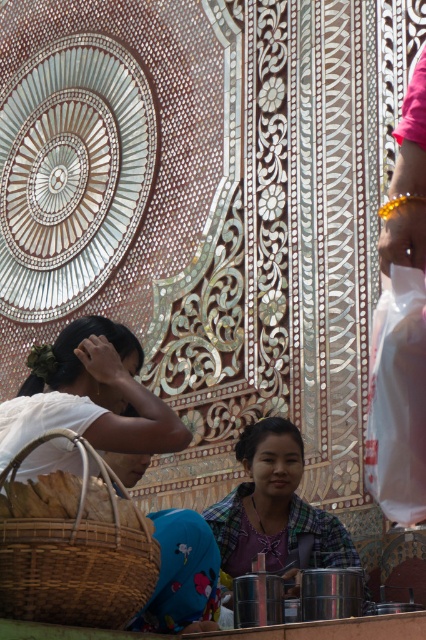
Is point (28, 618) closer to viewer compared to point (103, 499)?

Yes, point (28, 618) is in front of point (103, 499).

What are the coordinates of `brown woven basket at lower left` in the screenshot? It's located at (74, 556).

Which is in front, point (60, 378) or point (268, 500)?

Positioned in front is point (60, 378).

Identify the location of white matte hair at upper left. (89, 394).

Who is more forward, (52,424) or (259,467)?

Point (52,424) is more forward.

The height and width of the screenshot is (640, 426). What are the coordinates of `white matte hair at upper left` in the screenshot? It's located at (89, 394).

Is brown woven basket at lower left wider than plaid fabric shirt at center?

Yes, brown woven basket at lower left is wider than plaid fabric shirt at center.

Locate an element on the screen. The height and width of the screenshot is (640, 426). brown woven basket at lower left is located at coordinates (74, 556).

Find the location of `brown woven basket at lower left`. brown woven basket at lower left is located at coordinates [x=74, y=556].